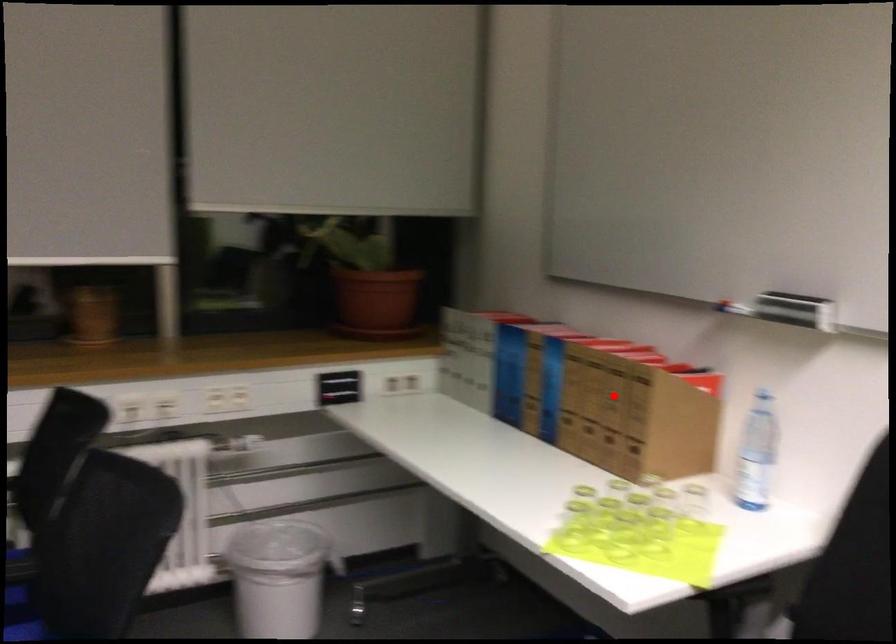
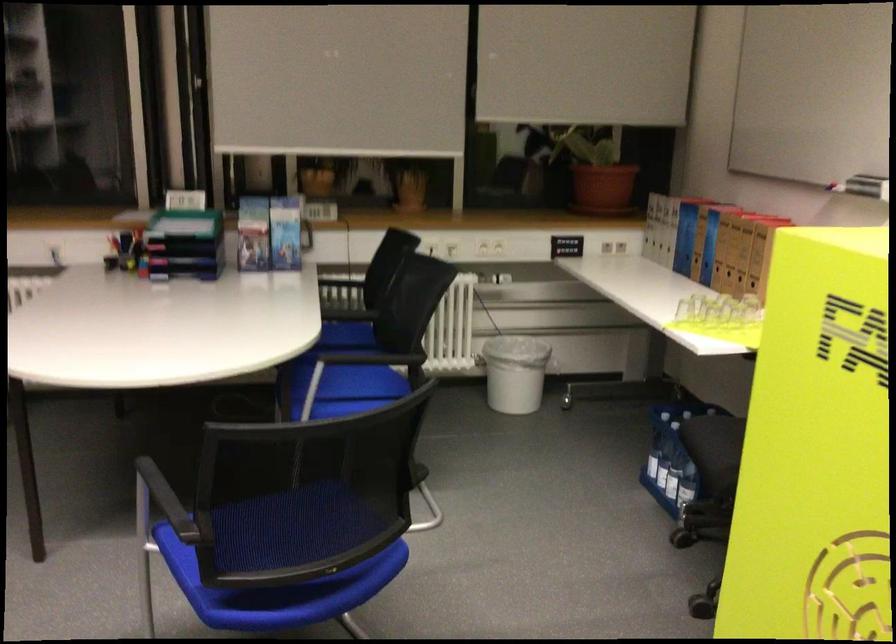
Question: I am providing you with two images of the same scene from different viewpoints. Given a red point in image1, look at the same physical point in image2. Is it:

Choices:
 (A) Closer to the viewpoint
 (B) Farther from the viewpoint

Answer: (B)